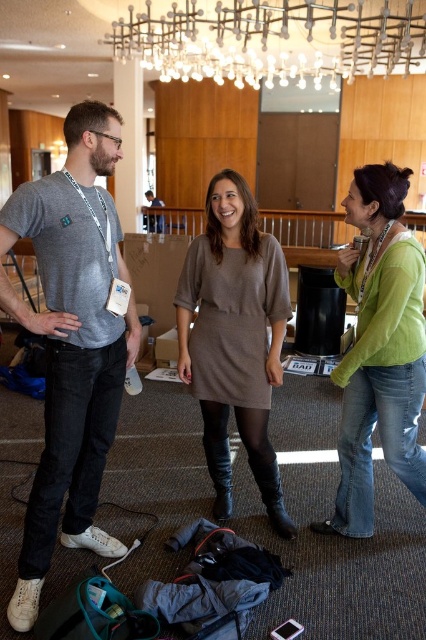
Question: Estimate the real-world distances between objects in this image. Which object is farther from the green knitwear at center?

Choices:
 (A) matte brown dress at center
 (B) matte gray t-shirt at center

Answer: (B)

Question: Which object is the farthest from the matte gray t-shirt at center?

Choices:
 (A) dark gray fabric shirt at center
 (B) green knitwear at center

Answer: (A)

Question: Considering the relative positions of matte gray t-shirt at center and matte brown dress at center in the image provided, where is matte gray t-shirt at center located with respect to matte brown dress at center?

Choices:
 (A) above
 (B) below

Answer: (A)

Question: Considering the real-world distances, which object is closest to the green knitwear at center?

Choices:
 (A) matte gray t-shirt at center
 (B) matte brown dress at center

Answer: (B)

Question: Can you confirm if matte brown dress at center is bigger than green knitwear at center?

Choices:
 (A) no
 (B) yes

Answer: (A)

Question: Can you confirm if green knitwear at center is positioned to the right of dark gray fabric shirt at center?

Choices:
 (A) no
 (B) yes

Answer: (B)